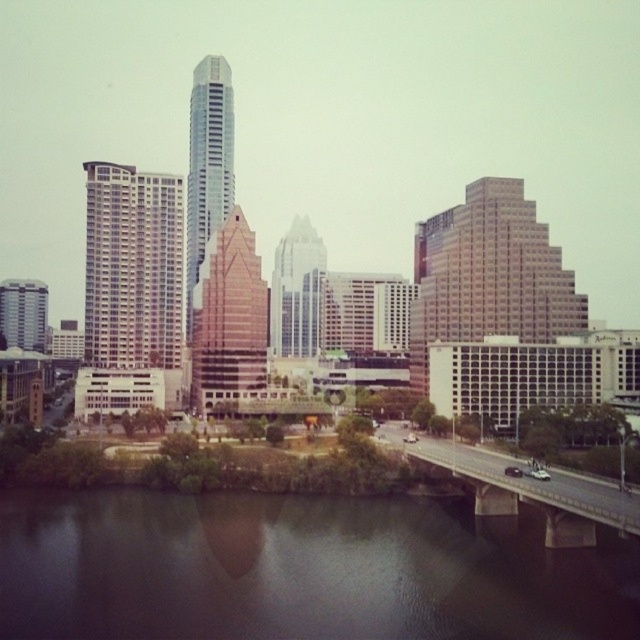
Does concrete bridge at lower right appear over glassy silver skyscraper at center?

No.

Is point (609, 497) less distant than point (230, 138)?

Yes, point (609, 497) is in front of point (230, 138).

Which is in front, point (428, 440) or point (230, 179)?

Point (428, 440) is more forward.

I want to click on concrete bridge at lower right, so click(536, 490).

Does beige textured building at center have a lesser width compared to brown textured building at center?

No.

Who is more distant from viewer, (417, 273) or (209, 330)?

The point (417, 273) is behind.

What do you see at coordinates (488, 275) in the screenshot? This screenshot has height=640, width=640. I see `beige textured building at center` at bounding box center [488, 275].

At what (x,y) coordinates should I click in order to perform the action: click on beige textured building at center. Please return your answer as a coordinate pair (x, y). The image size is (640, 640). Looking at the image, I should click on (488, 275).

Is brown textured building at center positioned in front of glassy reflective skyscraper at center?

Yes, brown textured building at center is closer to the viewer.

Who is positioned more to the left, brown textured building at center or glassy reflective skyscraper at center?

brown textured building at center

Identify the location of brown textured building at center. (228, 316).

Identify the location of brown textured building at center. This screenshot has height=640, width=640. (228, 316).